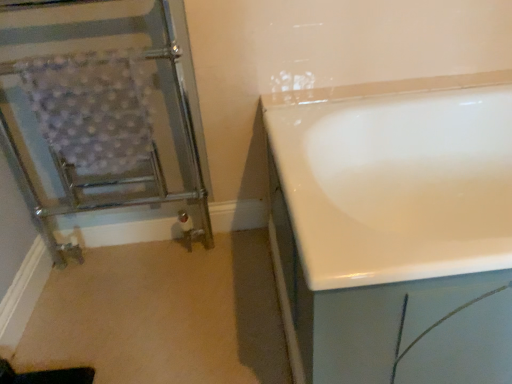
Question: Are chrome metallic towel rack at left and white glossy bathtub at right making contact?

Choices:
 (A) yes
 (B) no

Answer: (B)

Question: Is white glossy bathtub at right at the back of chrome metallic towel rack at left?

Choices:
 (A) no
 (B) yes

Answer: (A)

Question: From a real-world perspective, is chrome metallic towel rack at left located beneath white glossy bathtub at right?

Choices:
 (A) no
 (B) yes

Answer: (A)

Question: Does chrome metallic towel rack at left lie in front of white glossy bathtub at right?

Choices:
 (A) no
 (B) yes

Answer: (A)

Question: From the image's perspective, is chrome metallic towel rack at left on top of white glossy bathtub at right?

Choices:
 (A) yes
 (B) no

Answer: (A)

Question: Considering the relative positions of chrome metallic towel rack at left and white glossy bathtub at right in the image provided, is chrome metallic towel rack at left to the right of white glossy bathtub at right from the viewer's perspective?

Choices:
 (A) yes
 (B) no

Answer: (B)

Question: Is white glossy bathtub at right positioned behind chrome metallic towel rack at left?

Choices:
 (A) no
 (B) yes

Answer: (A)

Question: Is white glossy bathtub at right surrounding chrome metallic towel rack at left?

Choices:
 (A) yes
 (B) no

Answer: (B)

Question: Does white glossy bathtub at right have a greater height compared to chrome metallic towel rack at left?

Choices:
 (A) no
 (B) yes

Answer: (A)

Question: Is white glossy bathtub at right aimed at chrome metallic towel rack at left?

Choices:
 (A) yes
 (B) no

Answer: (B)

Question: Is white glossy bathtub at right wider than chrome metallic towel rack at left?

Choices:
 (A) no
 (B) yes

Answer: (B)

Question: Is white glossy bathtub at right at the left side of chrome metallic towel rack at left?

Choices:
 (A) no
 (B) yes

Answer: (A)

Question: In terms of width, does chrome metallic towel rack at left look wider or thinner when compared to white glossy bathtub at right?

Choices:
 (A) wide
 (B) thin

Answer: (B)